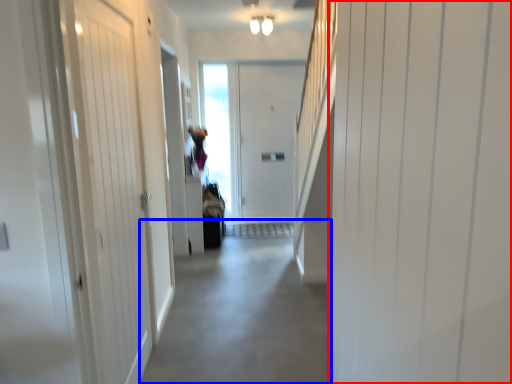
Question: Among these objects, which one is nearest to the camera, door (highlighted by a red box) or alley (highlighted by a blue box)?

Choices:
 (A) door
 (B) alley

Answer: (A)